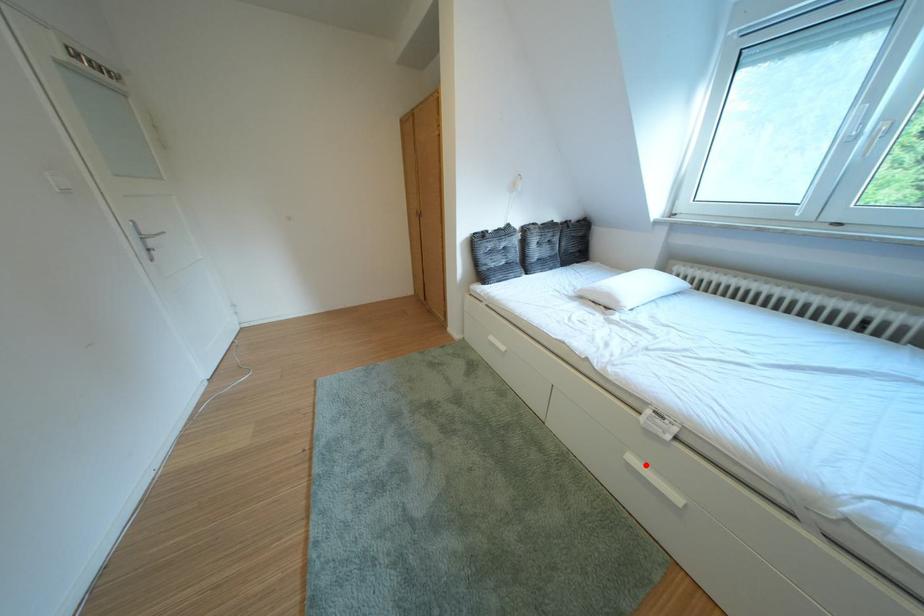
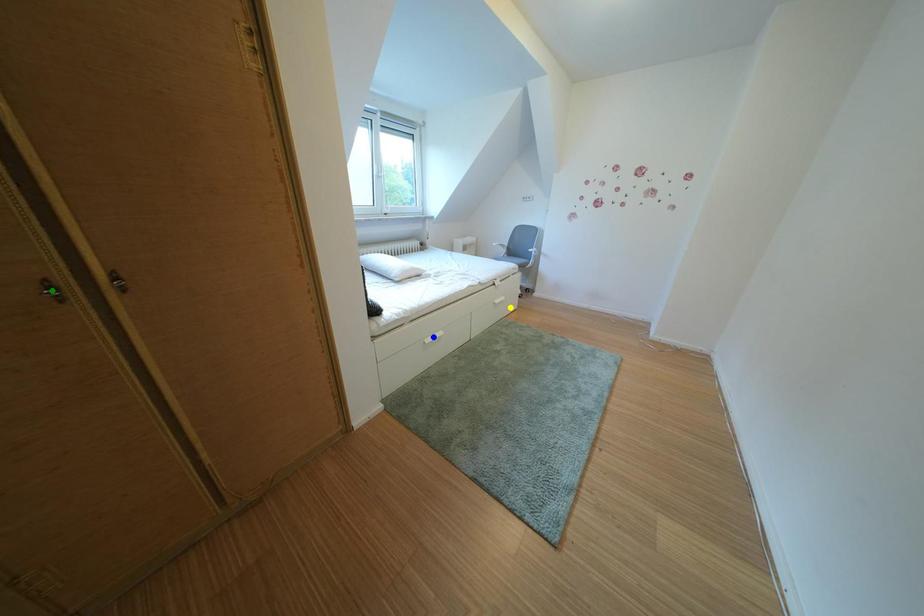
Question: I am providing you with two images of the same scene from different viewpoints. A red point is marked on the first image. You are given multiple points on the second image. In image 2, which mark is for the same physical point as the one in image 1?

Choices:
 (A) green point
 (B) blue point
 (C) yellow point

Answer: (C)